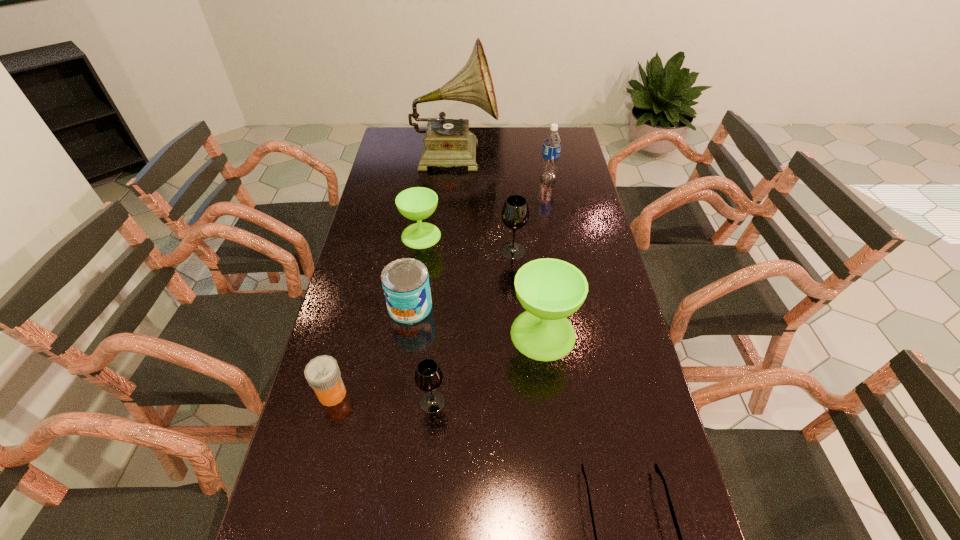
Where is `the fifth closest object to the bigger green wineglass`? the fifth closest object to the bigger green wineglass is located at coordinates (417, 203).

Identify which wineglass is located as the second nearest to the right gray wineglass. Please provide its 2D coordinates. Your answer should be formatted as a tuple, i.e. [(x, y)], where the tuple contains the x and y coordinates of a point satisfying the conditions above.

[(550, 290)]

Where is `wineglass that stands as the third closest to the smaller green wineglass`? wineglass that stands as the third closest to the smaller green wineglass is located at coordinates (428, 376).

I want to click on free location that satisfies the following two spatial constraints: 1. from the horn of the tallest object; 2. on the right side of the right gray wineglass, so click(447, 251).